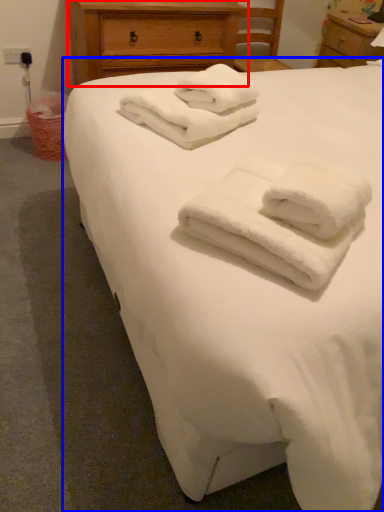
Question: Which of the following is the farthest to the observer, chest of drawers (highlighted by a red box) or bed (highlighted by a blue box)?

Choices:
 (A) chest of drawers
 (B) bed

Answer: (A)